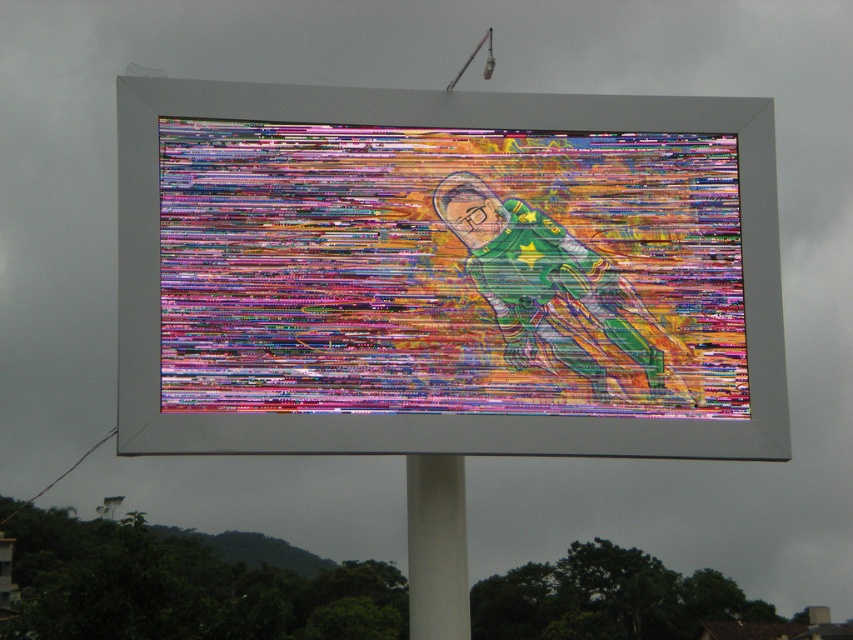
Is glitchy digital art at center bigger than white matte pole at center?

No, glitchy digital art at center is not bigger than white matte pole at center.

Is glitchy digital art at center smaller than white matte pole at center?

Yes, glitchy digital art at center is smaller than white matte pole at center.

I want to click on glitchy digital art at center, so click(448, 269).

I want to click on glitchy digital art at center, so (x=448, y=269).